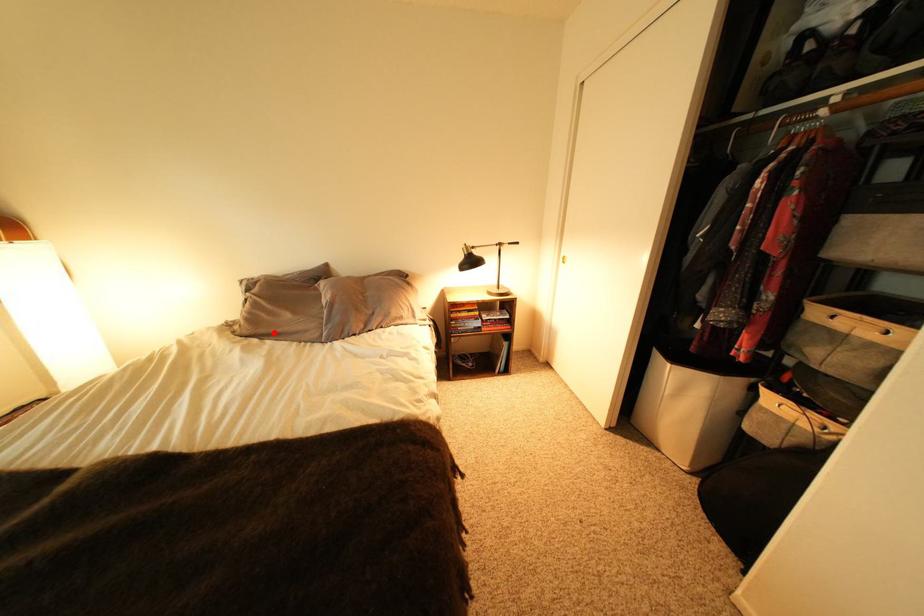
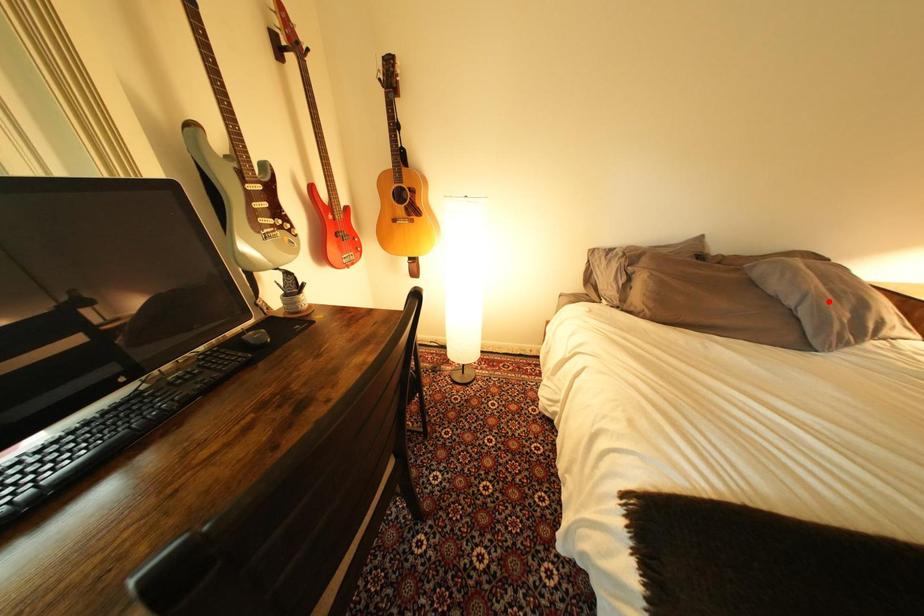
I am providing you with two images of the same scene from different viewpoints. A red point is marked on the first image and another point is marked on the second image. Do the highlighted points in image1 and image2 indicate the same real-world spot?

No